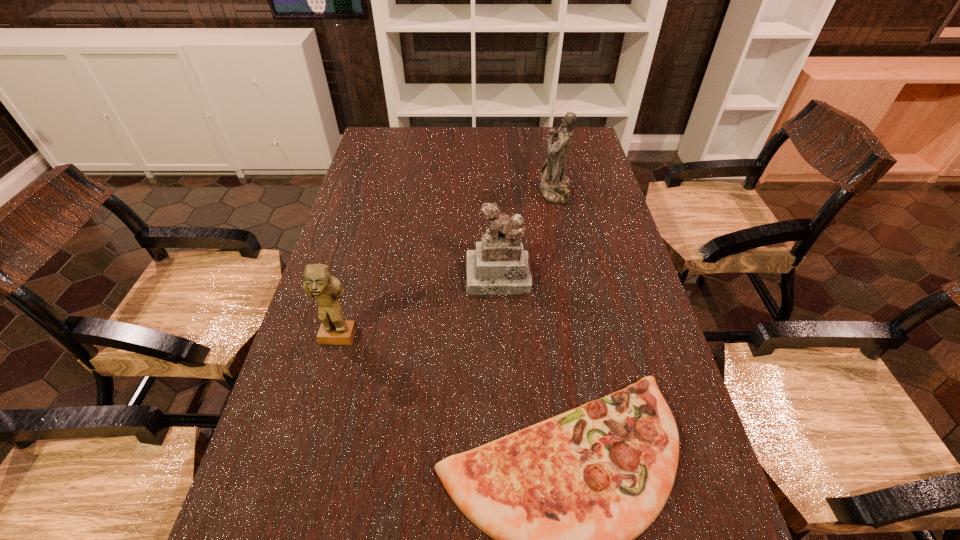
Find the location of a particular element. The height and width of the screenshot is (540, 960). the farthest object is located at coordinates (554, 185).

At what (x,y) coordinates should I click in order to perform the action: click on the rightmost figurine. Please return your answer as a coordinate pair (x, y). Looking at the image, I should click on (554, 185).

The height and width of the screenshot is (540, 960). What are the coordinates of `the second farthest figurine` in the screenshot? It's located at (498, 266).

Identify the location of the second farthest object. The width and height of the screenshot is (960, 540). (498, 266).

Where is `the leftmost object`? The height and width of the screenshot is (540, 960). the leftmost object is located at coordinates (318, 283).

Locate an element on the screen. Image resolution: width=960 pixels, height=540 pixels. the nearest figurine is located at coordinates (318, 283).

The image size is (960, 540). I want to click on free space located 0.320m on the front-facing side of the farthest object, so click(447, 191).

This screenshot has height=540, width=960. Find the location of `free location located 0.060m on the front-facing side of the farthest object`. free location located 0.060m on the front-facing side of the farthest object is located at coordinates (522, 191).

The height and width of the screenshot is (540, 960). I want to click on blank space located 0.080m on the front-facing side of the farthest object, so click(x=516, y=191).

Where is `free space located 0.150m on the front-facing side of the second figurine from right to left`? free space located 0.150m on the front-facing side of the second figurine from right to left is located at coordinates (502, 340).